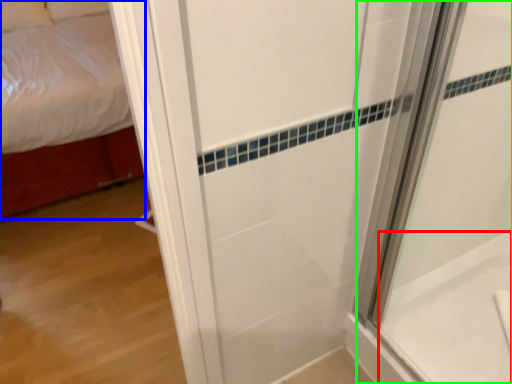
Question: Considering the real-world distances, which object is closest to bath (highlighted by a red box)? bed (highlighted by a blue box) or shower door (highlighted by a green box).

Choices:
 (A) bed
 (B) shower door

Answer: (B)